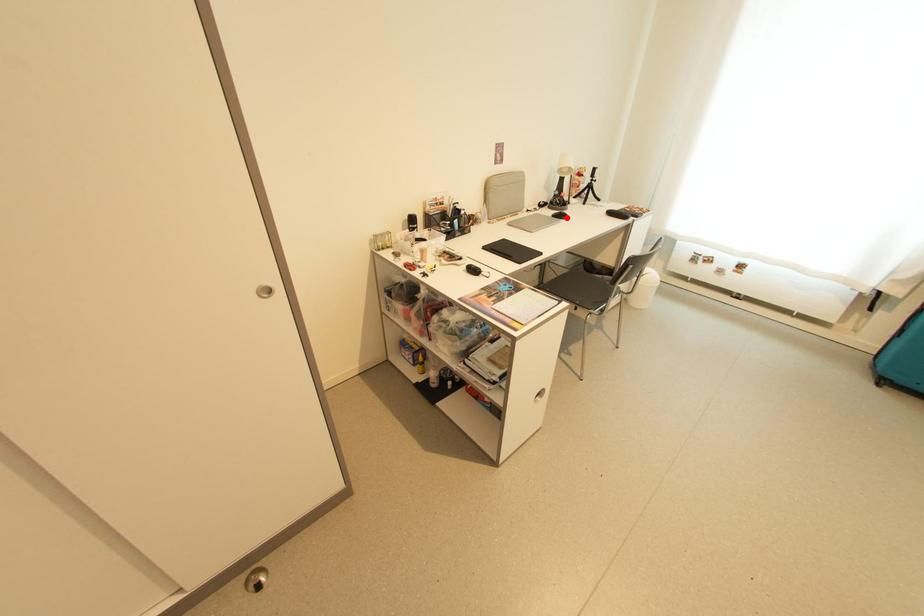
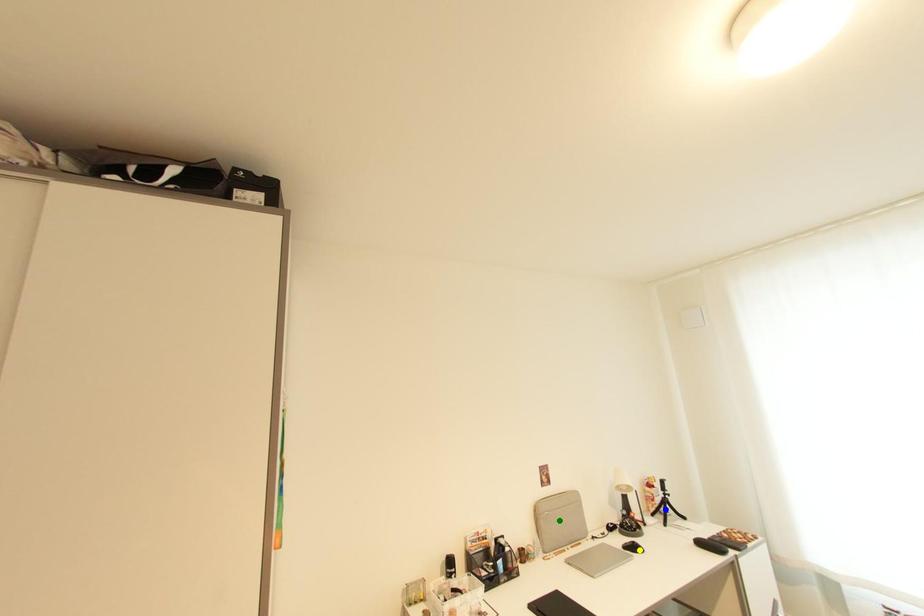
Question: I am providing you with two images of the same scene from different viewpoints. A red point is marked on the first image. You are given multiple points on the second image. Which spot in image 2 lines up with the point in image 1?

Choices:
 (A) blue point
 (B) yellow point
 (C) green point

Answer: (B)